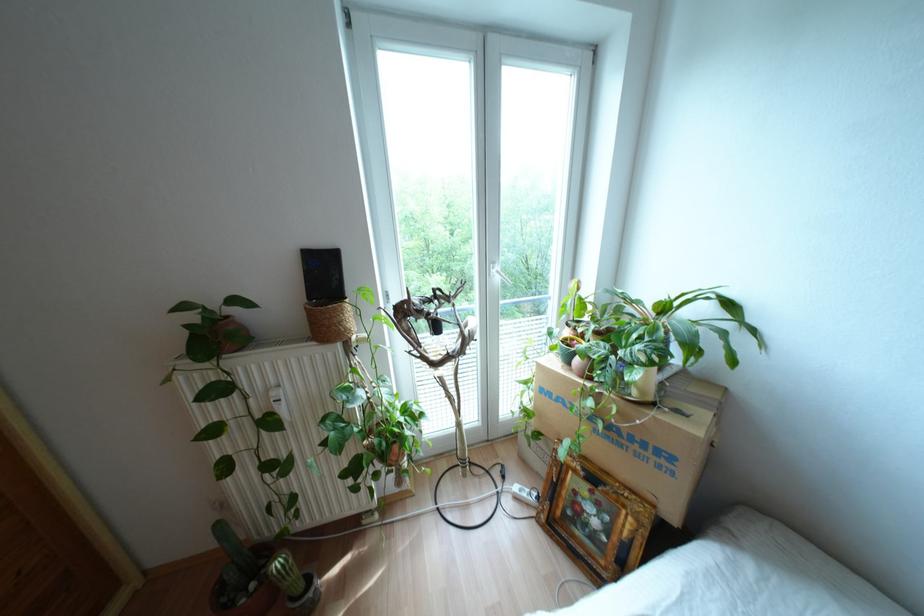
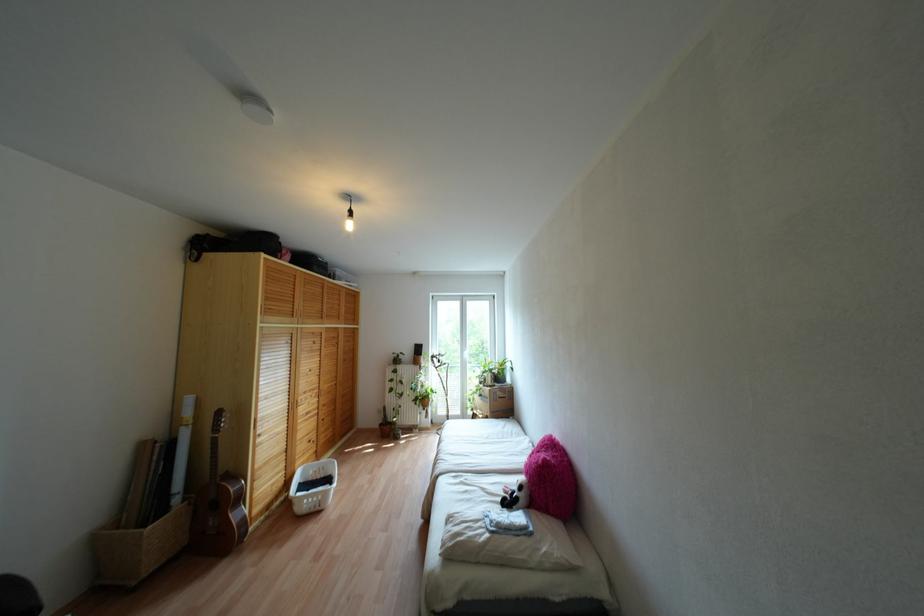
The point at (405, 408) is marked in the first image. Where is the corresponding point in the second image?

(431, 389)